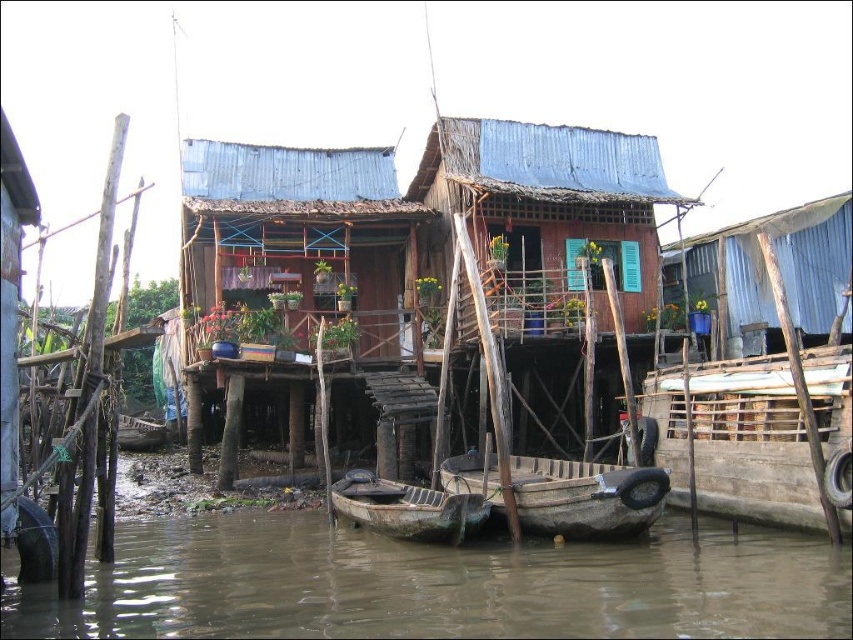
Is wooden planks boat at right in front of rusty metal boat at center?

Yes, wooden planks boat at right is closer to the viewer.

Can you confirm if wooden planks boat at right is shorter than rusty metal boat at center?

Incorrect, wooden planks boat at right's height does not fall short of rusty metal boat at center's.

Does point (788, 516) lie behind point (383, 515)?

No, (788, 516) is closer to viewer.

The height and width of the screenshot is (640, 853). Find the location of `wooden planks boat at right`. wooden planks boat at right is located at coordinates (755, 435).

Does brown muddy water at lower center have a smaller size compared to wooden boat at center?

Actually, brown muddy water at lower center might be larger than wooden boat at center.

Is brown muddy water at lower center above wooden boat at center?

No.

Is point (784, 625) positioned before point (520, 472)?

Yes, point (784, 625) is closer to viewer.

Where is `brown muddy water at lower center`? brown muddy water at lower center is located at coordinates (440, 584).

Which of these two, wooden planks boat at right or blue corrugated metal hut at upper right, stands shorter?

Standing shorter between the two is wooden planks boat at right.

Does point (753, 362) come closer to viewer compared to point (775, 310)?

Yes, point (753, 362) is in front of point (775, 310).

Locate an element on the screen. wooden planks boat at right is located at coordinates (755, 435).